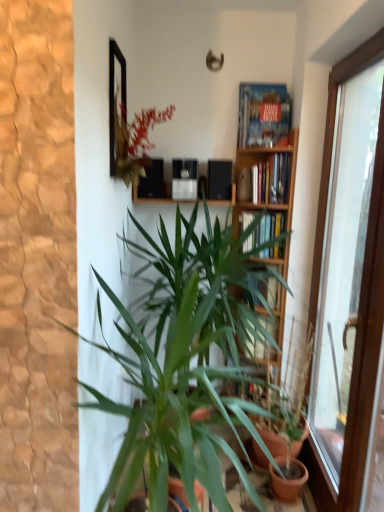
Question: Could you tell me if green leafy plant at center, the first houseplant viewed from the left, is facing hardcover books at center, acting as the 3th book starting from the top?

Choices:
 (A) yes
 (B) no

Answer: (B)

Question: Considering the relative positions of green leafy plant at center, placed as the second houseplant when sorted from right to left, and hardcover books at center, which is the first book from bottom to top, in the image provided, is green leafy plant at center, placed as the second houseplant when sorted from right to left, to the right of hardcover books at center, which is the first book from bottom to top, from the viewer's perspective?

Choices:
 (A) yes
 (B) no

Answer: (B)

Question: Is green leafy plant at center, placed as the first houseplant when sorted from front to back, looking in the opposite direction of hardcover books at center, which is the first book from bottom to top?

Choices:
 (A) yes
 (B) no

Answer: (B)

Question: Can you confirm if green leafy plant at center, the first houseplant viewed from the left, is positioned to the left of hardcover books at center, which is the first book from bottom to top?

Choices:
 (A) yes
 (B) no

Answer: (A)

Question: From a real-world perspective, is green leafy plant at center, placed as the first houseplant when sorted from front to back, under hardcover books at center, acting as the 3th book starting from the top?

Choices:
 (A) no
 (B) yes

Answer: (B)

Question: Can you confirm if green leafy plant at center, placed as the first houseplant when sorted from front to back, is taller than hardcover books at center, which is the first book from bottom to top?

Choices:
 (A) yes
 (B) no

Answer: (A)

Question: From the image's perspective, does wooden bookshelf at upper center, marked as the 2th book in a top-to-bottom arrangement, appear higher than green leafy plant at center, placed as the first houseplant when sorted from front to back?

Choices:
 (A) yes
 (B) no

Answer: (A)

Question: Is wooden bookshelf at upper center, the second book positioned from the bottom, outside green leafy plant at center, placed as the first houseplant when sorted from front to back?

Choices:
 (A) yes
 (B) no

Answer: (A)

Question: Is wooden bookshelf at upper center, the second book positioned from the bottom, positioned before green leafy plant at center, placed as the first houseplant when sorted from front to back?

Choices:
 (A) yes
 (B) no

Answer: (B)

Question: Is wooden bookshelf at upper center, the second book positioned from the bottom, not near green leafy plant at center, placed as the first houseplant when sorted from front to back?

Choices:
 (A) no
 (B) yes

Answer: (A)

Question: Does wooden bookshelf at upper center, marked as the 2th book in a top-to-bottom arrangement, have a greater height compared to green leafy plant at center, placed as the second houseplant when sorted from right to left?

Choices:
 (A) no
 (B) yes

Answer: (A)

Question: Does wooden bookshelf at upper center, marked as the 2th book in a top-to-bottom arrangement, have a smaller size compared to green leafy plant at center, placed as the first houseplant when sorted from front to back?

Choices:
 (A) yes
 (B) no

Answer: (A)

Question: Is matte black speakers at upper center behind transparent glass door at right?

Choices:
 (A) yes
 (B) no

Answer: (A)